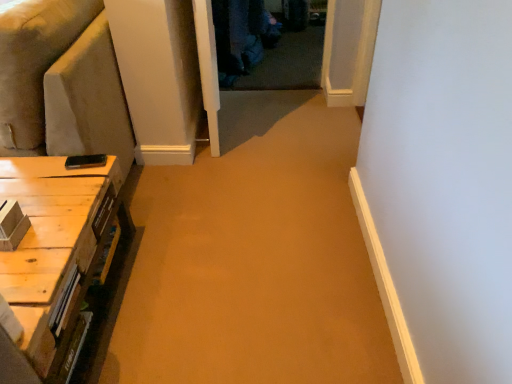
Question: Can you confirm if light brown wood table at lower left is bigger than suede-like beige couch at left?

Choices:
 (A) yes
 (B) no

Answer: (B)

Question: Can suede-like beige couch at left be found inside light brown wood table at lower left?

Choices:
 (A) yes
 (B) no

Answer: (B)

Question: From a real-world perspective, does light brown wood table at lower left sit lower than suede-like beige couch at left?

Choices:
 (A) yes
 (B) no

Answer: (A)

Question: Can you confirm if light brown wood table at lower left is smaller than suede-like beige couch at left?

Choices:
 (A) no
 (B) yes

Answer: (B)

Question: Is light brown wood table at lower left at the left side of suede-like beige couch at left?

Choices:
 (A) no
 (B) yes

Answer: (A)

Question: Is light brown wood table at lower left located outside suede-like beige couch at left?

Choices:
 (A) no
 (B) yes

Answer: (B)

Question: Can you confirm if suede-like beige couch at left is positioned to the left of light brown wood table at lower left?

Choices:
 (A) no
 (B) yes

Answer: (B)

Question: Is suede-like beige couch at left smaller than light brown wood table at lower left?

Choices:
 (A) yes
 (B) no

Answer: (B)

Question: Is suede-like beige couch at left closer to camera compared to light brown wood table at lower left?

Choices:
 (A) no
 (B) yes

Answer: (A)

Question: Is suede-like beige couch at left looking in the opposite direction of light brown wood table at lower left?

Choices:
 (A) no
 (B) yes

Answer: (A)

Question: Does suede-like beige couch at left have a larger size compared to light brown wood table at lower left?

Choices:
 (A) yes
 (B) no

Answer: (A)

Question: Is suede-like beige couch at left wider than light brown wood table at lower left?

Choices:
 (A) no
 (B) yes

Answer: (B)

Question: Would you say suede-like beige couch at left is to the left or to the right of light brown wood table at lower left in the picture?

Choices:
 (A) left
 (B) right

Answer: (A)